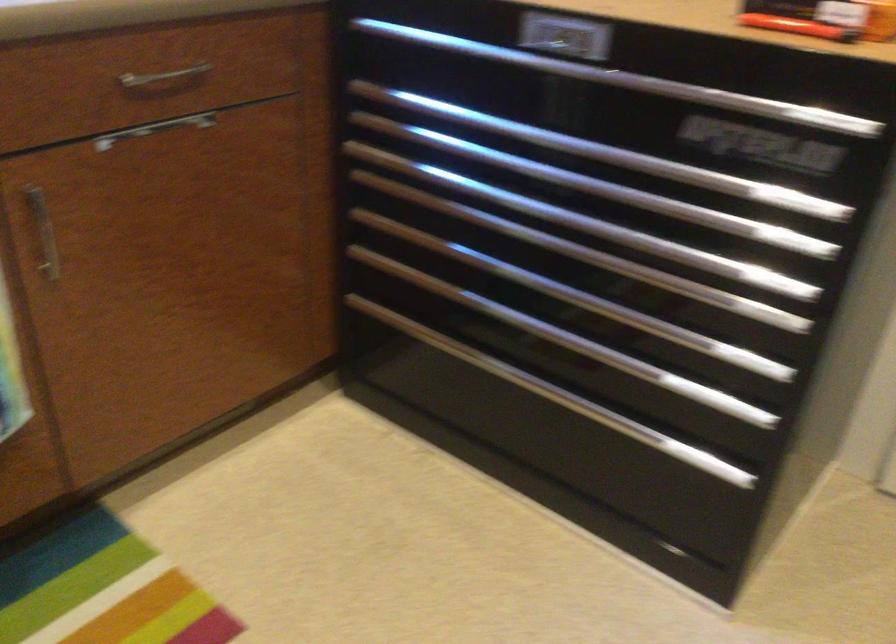
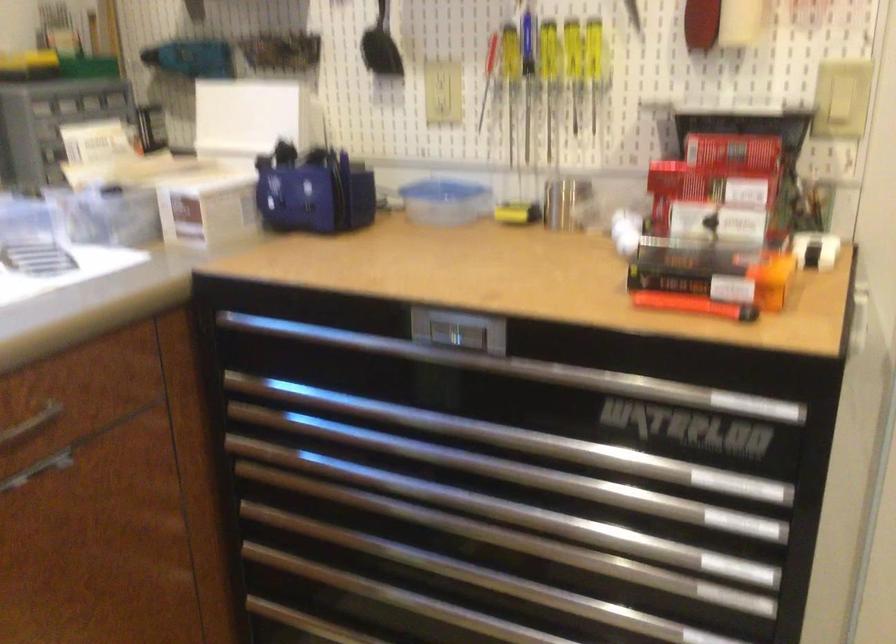
What movement of the cameraman would produce the second image?

The cameraman walked toward left, forward.